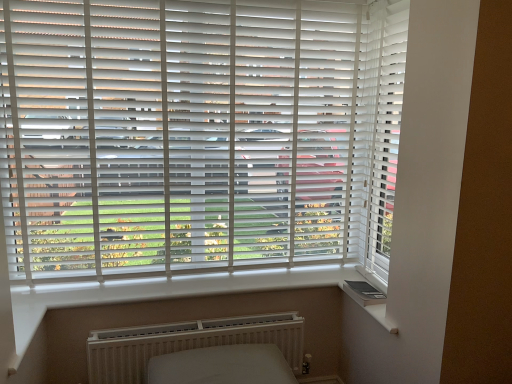
Question: Is white textured radiator at lower center outside white smooth window sill at lower right?

Choices:
 (A) no
 (B) yes

Answer: (B)

Question: Is white textured radiator at lower center far from white smooth window sill at lower right?

Choices:
 (A) yes
 (B) no

Answer: (B)

Question: Is white textured radiator at lower center oriented away from white smooth window sill at lower right?

Choices:
 (A) yes
 (B) no

Answer: (B)

Question: Could you tell me if white textured radiator at lower center is facing white smooth window sill at lower right?

Choices:
 (A) no
 (B) yes

Answer: (A)

Question: From the image's perspective, would you say white textured radiator at lower center is positioned over white smooth window sill at lower right?

Choices:
 (A) no
 (B) yes

Answer: (A)

Question: Does white textured radiator at lower center have a greater width compared to white smooth window sill at lower right?

Choices:
 (A) yes
 (B) no

Answer: (B)

Question: Does white matte blinds at center have a lesser width compared to white textured radiator at lower center?

Choices:
 (A) no
 (B) yes

Answer: (B)

Question: Is white matte blinds at center wider than white textured radiator at lower center?

Choices:
 (A) yes
 (B) no

Answer: (B)

Question: Is the position of white matte blinds at center less distant than that of white textured radiator at lower center?

Choices:
 (A) no
 (B) yes

Answer: (B)

Question: From the image's perspective, would you say white matte blinds at center is positioned over white textured radiator at lower center?

Choices:
 (A) no
 (B) yes

Answer: (B)

Question: Does white matte blinds at center have a larger size compared to white textured radiator at lower center?

Choices:
 (A) yes
 (B) no

Answer: (A)

Question: Would you say white matte blinds at center is outside white textured radiator at lower center?

Choices:
 (A) yes
 (B) no

Answer: (A)

Question: Is white smooth window sill at lower right positioned in front of white matte blinds at center?

Choices:
 (A) yes
 (B) no

Answer: (B)